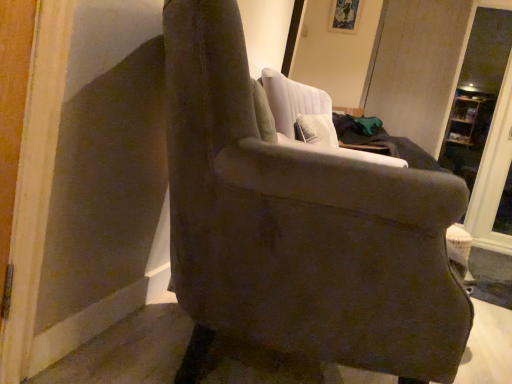
What is the approximate width of velvet dark brown armchair at center?

velvet dark brown armchair at center is 35.10 inches wide.

What do you see at coordinates (298, 226) in the screenshot? I see `velvet dark brown armchair at center` at bounding box center [298, 226].

Where is `velvet dark brown armchair at center`? Image resolution: width=512 pixels, height=384 pixels. velvet dark brown armchair at center is located at coordinates (298, 226).

The image size is (512, 384). Identify the location of velvet dark brown armchair at center. (298, 226).